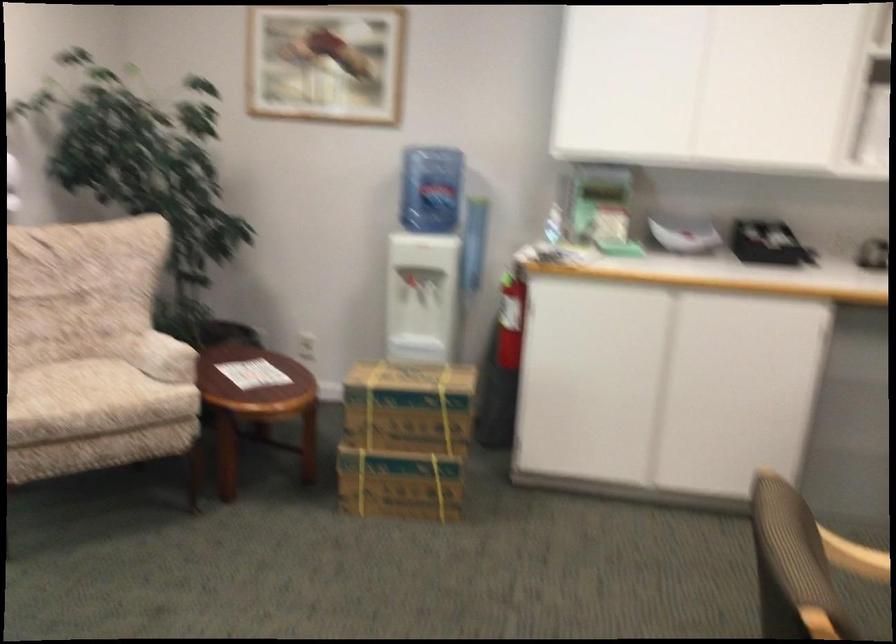
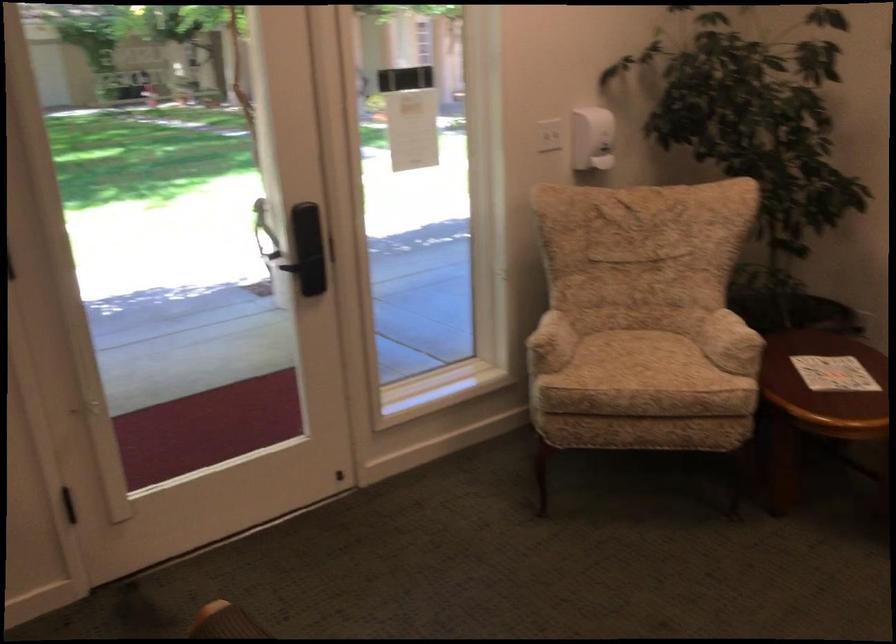
Question: The images are taken continuously from a first-person perspective. In which direction is your viewpoint rotating?

Choices:
 (A) Left
 (B) Right
 (C) Up
 (D) Down

Answer: (A)